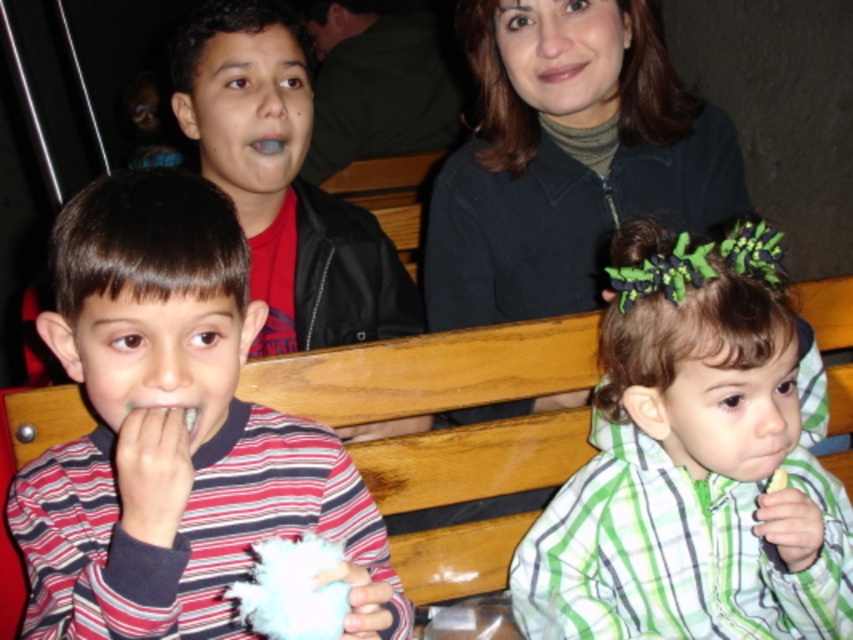
Does striped cotton shirt at left appear under green plaid shirt at right?

No.

Does striped cotton shirt at left have a lesser height compared to green plaid shirt at right?

Indeed, striped cotton shirt at left has a lesser height compared to green plaid shirt at right.

You are a GUI agent. You are given a task and a screenshot of the screen. Output one action in this format:
    pyautogui.click(x=<x>, y=<y>)
    Task: Click on the striped cotton shirt at left
    
    Given the screenshot: What is the action you would take?
    pyautogui.click(x=173, y=433)

The image size is (853, 640). In order to click on striped cotton shirt at left in this screenshot , I will do `click(173, 433)`.

Who is higher up, striped cotton shirt at left or dark green turtleneck at upper center?

dark green turtleneck at upper center is above.

Is point (88, 586) positioned after point (561, 154)?

No.

Identify the location of striped cotton shirt at left. Image resolution: width=853 pixels, height=640 pixels. click(173, 433).

How much distance is there between green plaid shirt at right and dark green turtleneck at upper center?

A distance of 13.82 inches exists between green plaid shirt at right and dark green turtleneck at upper center.

Between point (648, 416) and point (436, 198), which one is positioned in front?

Point (648, 416)

Identify the location of green plaid shirt at right. The width and height of the screenshot is (853, 640). (694, 458).